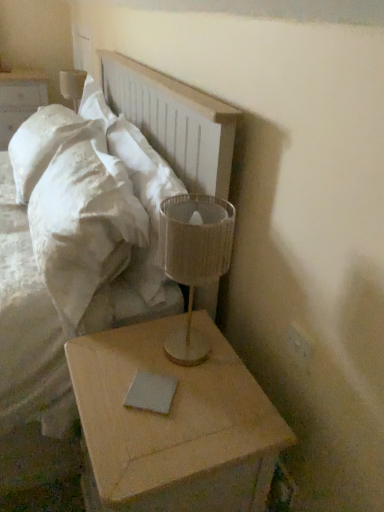
Locate an element on the screen. free location in front of gray matte notepad at lower center is located at coordinates (150, 440).